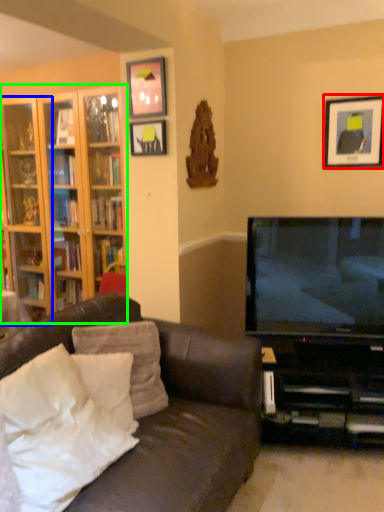
Question: Which object is the farthest from picture frame (highlighted by a red box)? Choose among these: shelf (highlighted by a blue box) or cabinetry (highlighted by a green box).

Choices:
 (A) shelf
 (B) cabinetry

Answer: (A)